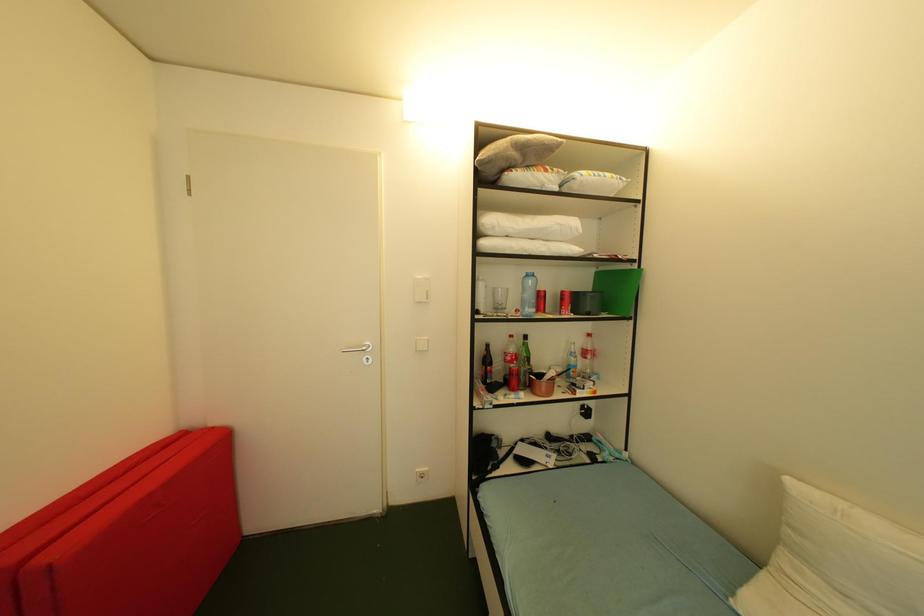
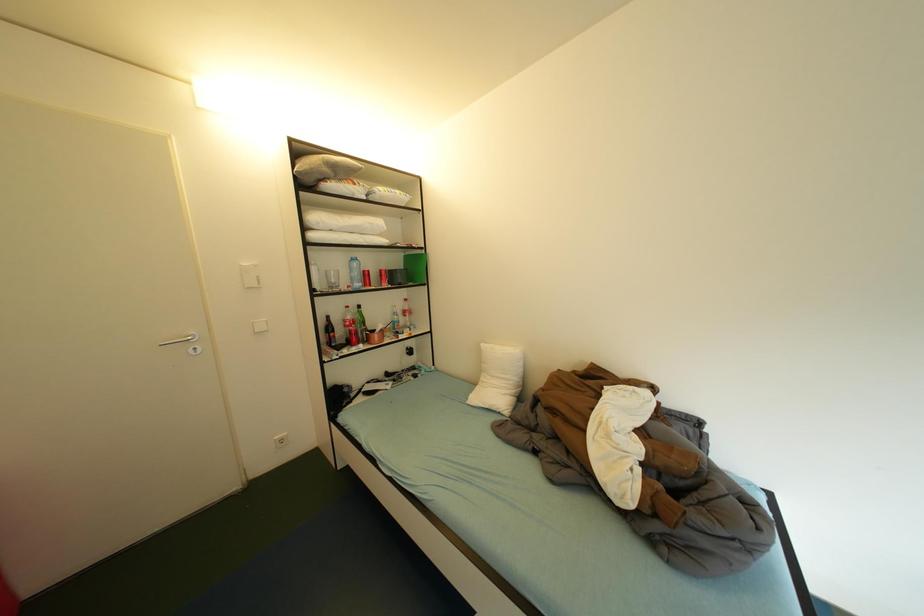
Question: The camera is either moving clockwise (left) or counter-clockwise (right) around the object. The first image is from the beginning of the video and the second image is from the end. Is the camera moving left or right when shooting the video?

Choices:
 (A) Left
 (B) Right

Answer: (A)